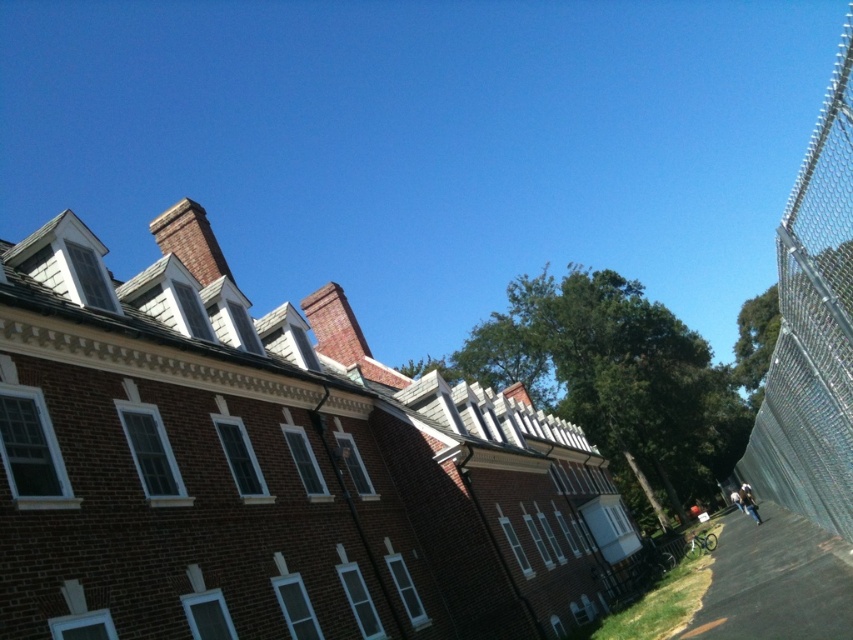
Measure the distance between metallic chain-link fence at right and gray asphalt pavement at lower right.

metallic chain-link fence at right and gray asphalt pavement at lower right are 38.70 meters apart from each other.

Between metallic chain-link fence at right and gray asphalt pavement at lower right, which one appears on the left side from the viewer's perspective?

Positioned to the left is gray asphalt pavement at lower right.

Is point (846, 12) farther from viewer compared to point (844, 605)?

Yes.

Identify the location of metallic chain-link fence at right. (813, 328).